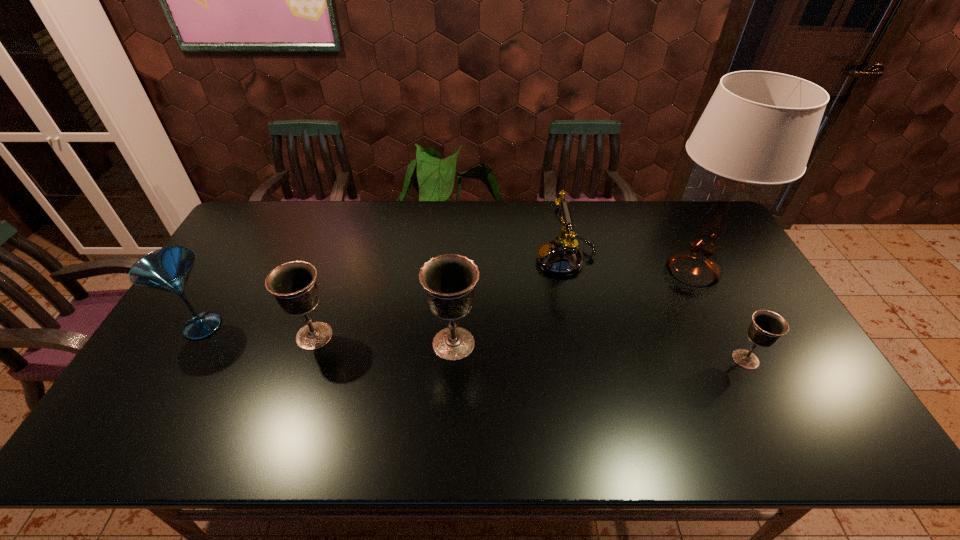
Where is `the leftmost chalice`? The image size is (960, 540). the leftmost chalice is located at coordinates (293, 284).

This screenshot has height=540, width=960. I want to click on the fifth object from right to left, so click(293, 284).

At what (x,y) coordinates should I click in order to perform the action: click on the fourth object from right to left. Please return your answer as a coordinate pair (x, y). This screenshot has width=960, height=540. Looking at the image, I should click on (449, 280).

Where is `the shortest chalice`? The width and height of the screenshot is (960, 540). the shortest chalice is located at coordinates (766, 328).

I want to click on the rightmost chalice, so click(x=766, y=328).

The height and width of the screenshot is (540, 960). What are the coordinates of `table lamp` in the screenshot? It's located at (759, 127).

Find the location of `the fourth object from left to right`. the fourth object from left to right is located at coordinates (562, 256).

This screenshot has width=960, height=540. I want to click on the leftmost object, so click(167, 269).

The height and width of the screenshot is (540, 960). What are the coordinates of `vacant space located on the right of the second object from left to right` in the screenshot? It's located at (463, 336).

I want to click on vacant position located 0.360m on the back of the fourth object from right to left, so click(x=459, y=243).